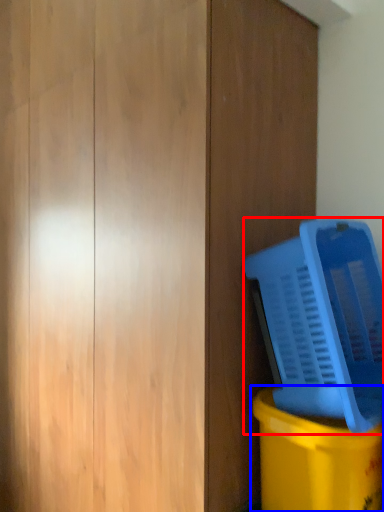
Question: Which of the following is the farthest to the observer, water cooler (highlighted by a red box) or waste container (highlighted by a blue box)?

Choices:
 (A) water cooler
 (B) waste container

Answer: (B)